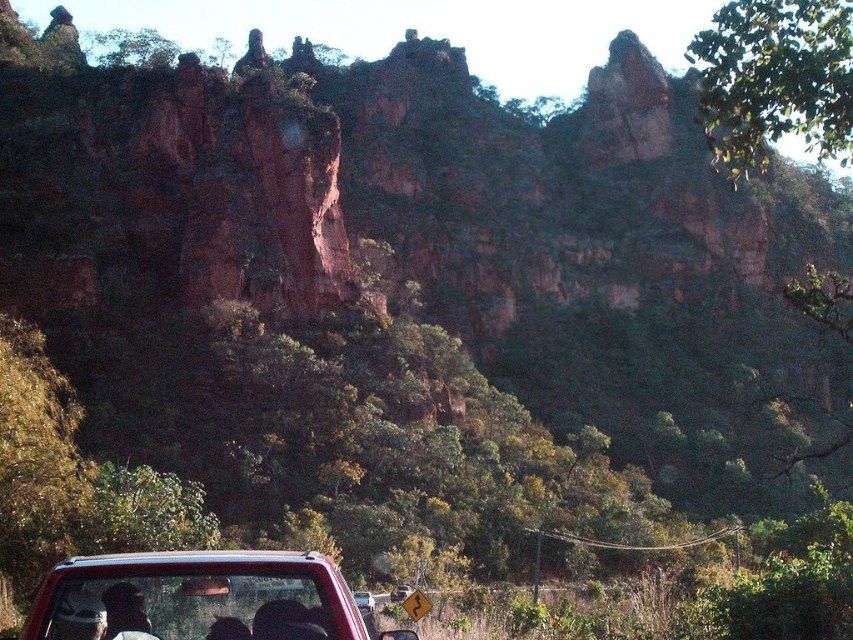
Is matte red truck at lower center positioned behind metallic red car at lower center?

No, matte red truck at lower center is in front of metallic red car at lower center.

Between point (236, 556) and point (370, 595), which one is positioned behind?

The point (370, 595) is behind.

Who is more distant from viewer, (166, 595) or (358, 608)?

Point (358, 608)

Identify the location of matte red truck at lower center. (195, 596).

Is the position of dark hair at lower center more distant than that of metallic red car at lower center?

No, dark hair at lower center is in front of metallic red car at lower center.

Is point (142, 604) less distant than point (372, 611)?

Yes, it is in front of point (372, 611).

Identify the location of dark hair at lower center. (125, 612).

Is matte red truck at lower center closer to camera compared to dark hair at lower center?

Yes, matte red truck at lower center is in front of dark hair at lower center.

Locate an element on the screen. The height and width of the screenshot is (640, 853). matte red truck at lower center is located at coordinates (195, 596).